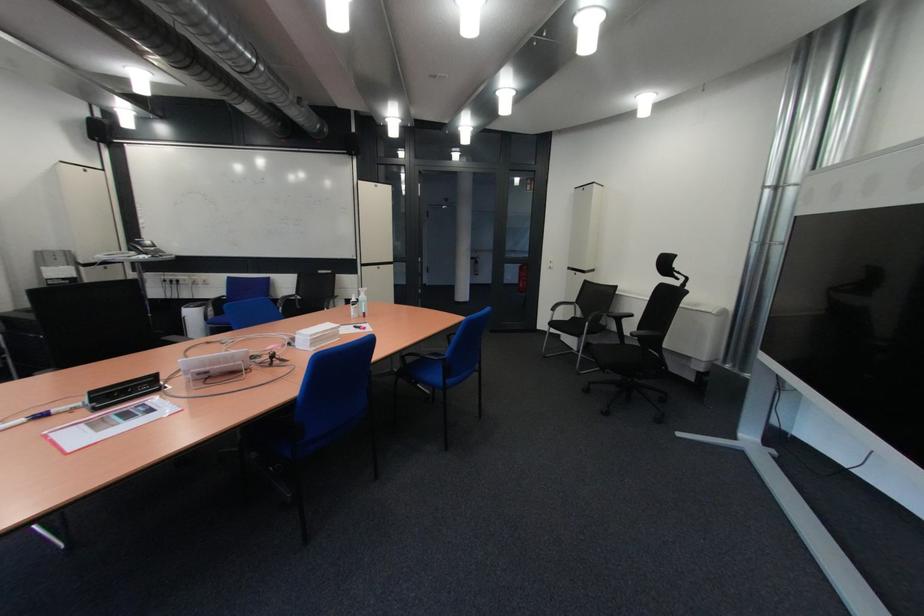
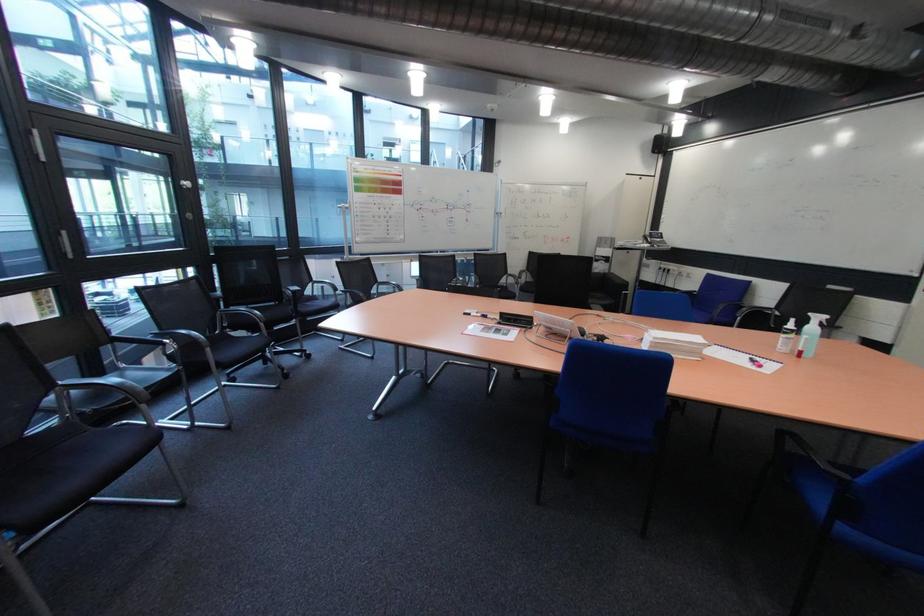
Question: The images are taken continuously from a first-person perspective. In which direction is your viewpoint rotating?

Choices:
 (A) Left
 (B) Right
 (C) Up
 (D) Down

Answer: (A)